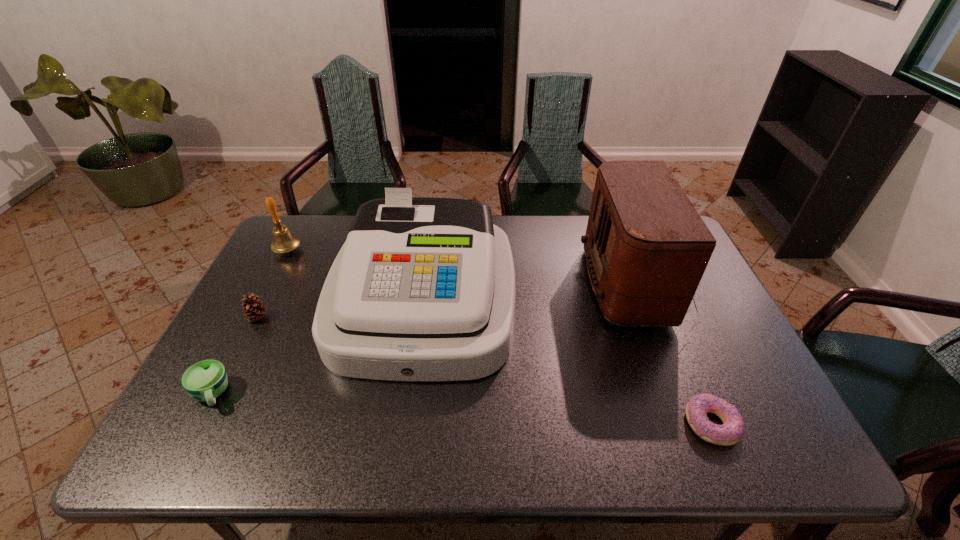
Locate an element on the screen. This screenshot has height=540, width=960. blank area in the image that satisfies the following two spatial constraints: 1. on the front side of the fourth object from left to right; 2. on the right side of the fourth shortest object is located at coordinates (261, 301).

Image resolution: width=960 pixels, height=540 pixels. I want to click on vacant space that satisfies the following two spatial constraints: 1. on the back side of the fifth tallest object; 2. on the left side of the fourth shortest object, so (286, 250).